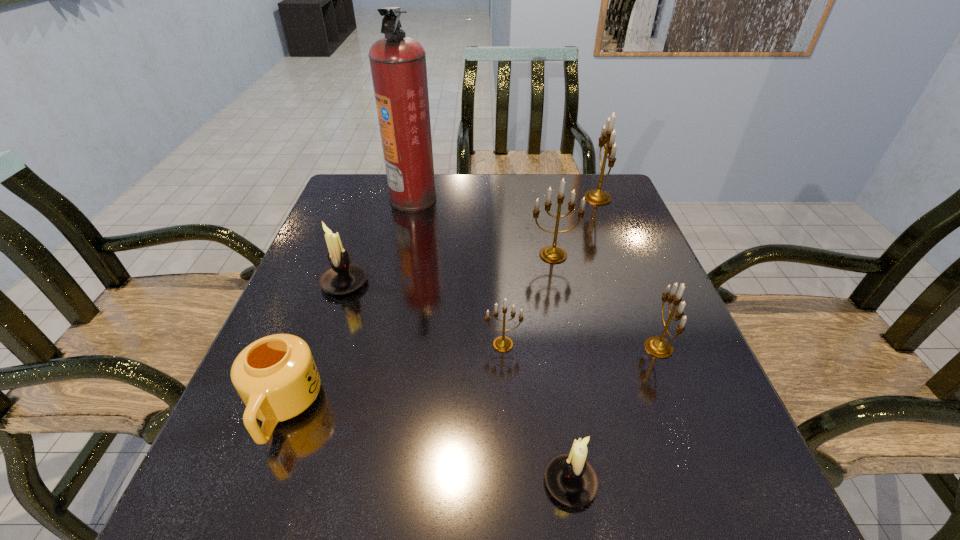
Locate an element on the screen. vacant space that is in between the fourth nearest candelabrum and the tallest candelabrum is located at coordinates (471, 240).

The height and width of the screenshot is (540, 960). In order to click on unoccupied position between the farthest candelabrum and the mug in this screenshot , I will do `click(441, 303)`.

Find the location of a particular element. unoccupied area between the seventh farthest object and the third biggest gold candelabrum is located at coordinates (471, 378).

Where is `vacant area that lies between the nearest object and the second gold candelabrum from left to right`? vacant area that lies between the nearest object and the second gold candelabrum from left to right is located at coordinates (562, 369).

I want to click on free space between the second tallest candelabrum and the red fire extinguisher, so click(x=483, y=227).

Locate an element on the screen. The image size is (960, 540). empty space that is in between the nearest candelabrum and the second smallest gold candelabrum is located at coordinates (614, 415).

Choose which object is the second nearest neighbor to the tallest object. Please provide its 2D coordinates. Your answer should be formatted as a tuple, i.e. [(x, y)], where the tuple contains the x and y coordinates of a point satisfying the conditions above.

[(552, 254)]

Select which object appears as the seventh closest to the smaller white candle holder. Please provide its 2D coordinates. Your answer should be formatted as a tuple, i.e. [(x, y)], where the tuple contains the x and y coordinates of a point satisfying the conditions above.

[(597, 197)]

The height and width of the screenshot is (540, 960). I want to click on the sixth closest candelabrum relative to the mug, so click(597, 197).

Locate which candelabrum is the fourth closest to the fire extinguisher. Please provide its 2D coordinates. Your answer should be formatted as a tuple, i.e. [(x, y)], where the tuple contains the x and y coordinates of a point satisfying the conditions above.

[(502, 343)]